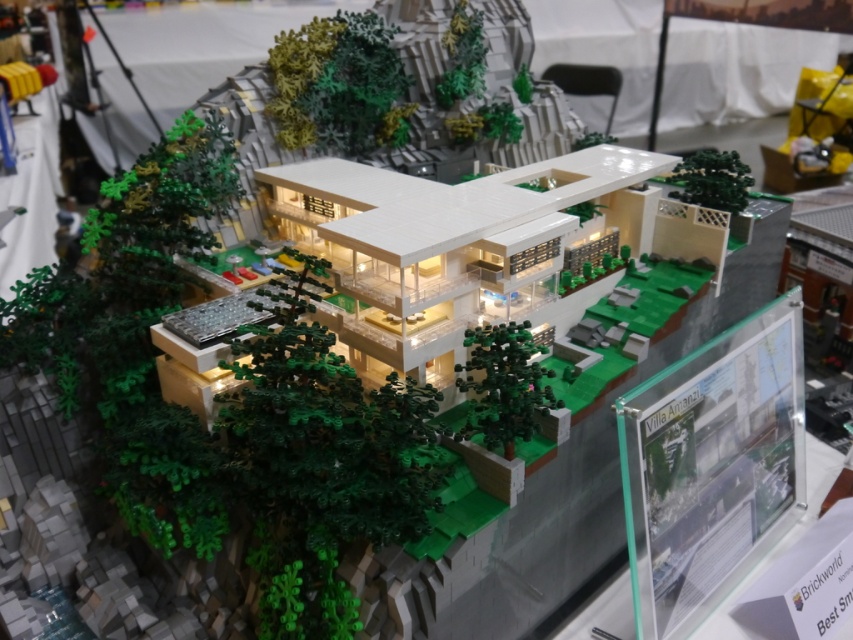
You are standing 1.70 meters away from the point marked at coordinates (x=383, y=120) in the LEGO villa model. If you want to place a LEGO tree exactly at that point, will you be able to do so without moving closer?

Yes, you can place the LEGO tree at the point marked at coordinates (x=383, y=120) because you are already 1.70 meters away from it, which should be a sufficient distance to access the area without needing to move closer.

You are a drone operator flying a drone with a camera. You need to capture a photo of the green matte tree at upper center. According to the villa layout, where should you position the drone to get the best shot?

The green matte tree at upper center is located at point 2D coordinates of (339, 84). To capture the best shot, position the drone directly above this coordinate to ensure the tree is centered in the frame.

You are a visitor at the LEGO exhibition and want to take a photo of the Villa Amanzi. You notice two green matte trees in the background. Which tree, the green matte tree at upper center or the green matte tree at upper right, would appear bigger in your photo?

The green matte tree at upper center appears bigger in the photo because it has a larger size compared to the green matte tree at upper right.